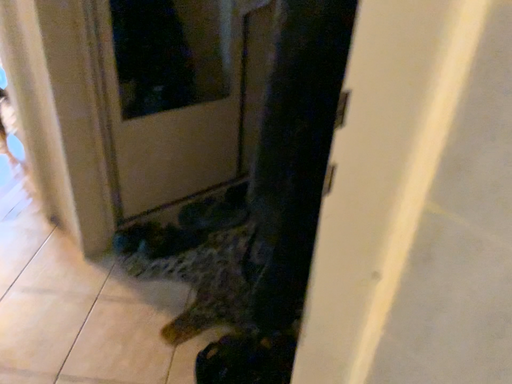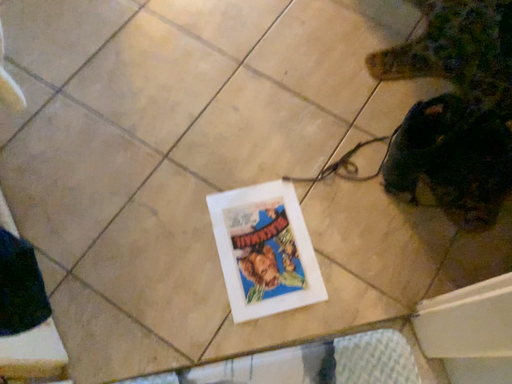
Question: How did the camera likely rotate when shooting the video?

Choices:
 (A) rotated right
 (B) rotated left

Answer: (B)